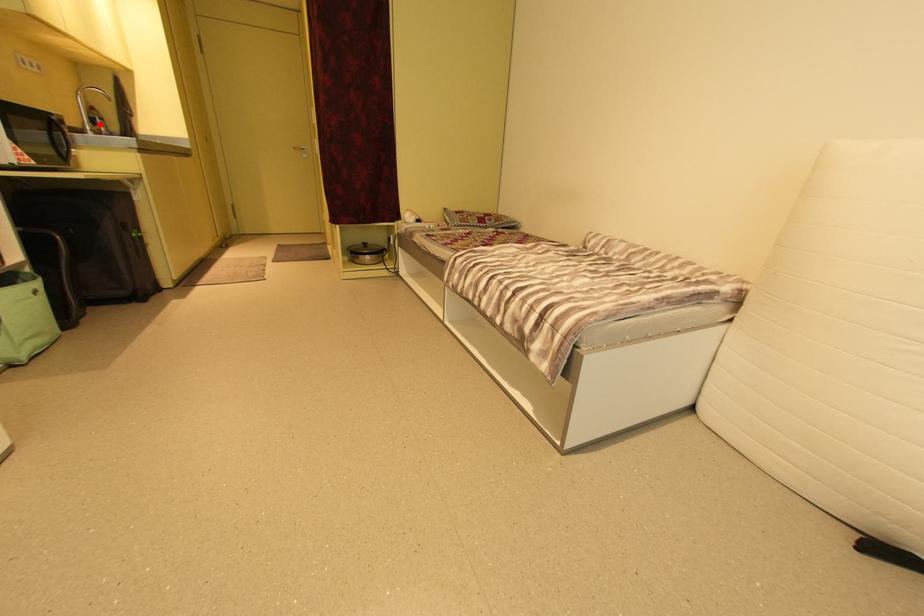
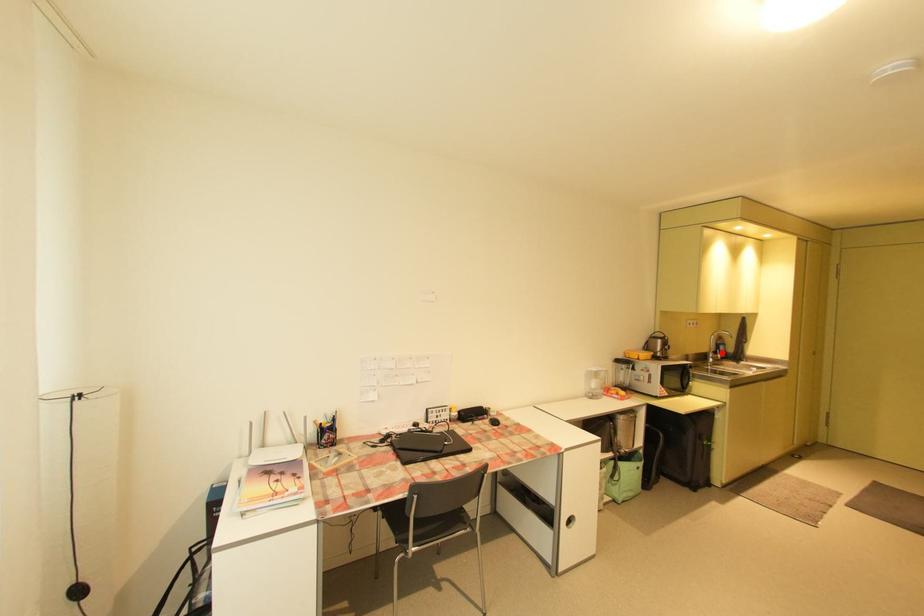
I am providing you with two images of the same scene from different viewpoints. A red point is marked on the first image and another point is marked on the second image. Do the highlighted points in image1 and image2 indicate the same real-world spot?

Yes